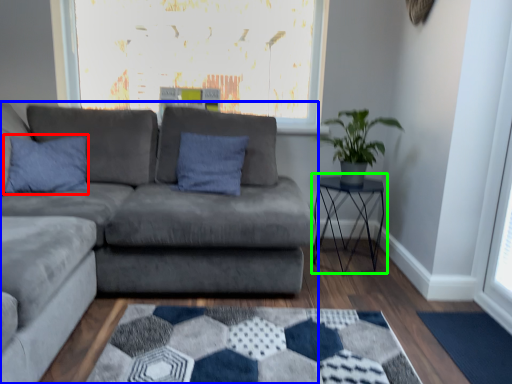
Question: Based on their relative distances, which object is farther from pillow (highlighted by a red box)? Choose from studio couch (highlighted by a blue box) and table (highlighted by a green box).

Choices:
 (A) studio couch
 (B) table

Answer: (B)